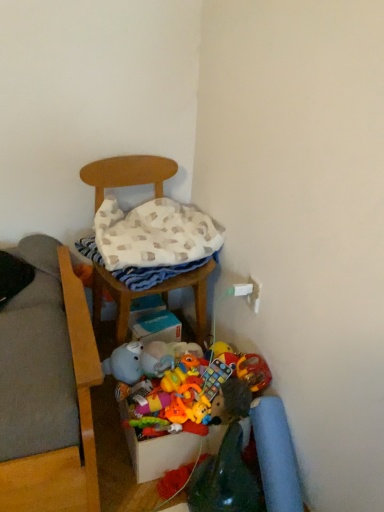
Question: Is wooden chair at center positioned far away from multicolored fabric storage box at lower center?

Choices:
 (A) no
 (B) yes

Answer: (A)

Question: Does wooden chair at center come behind multicolored fabric storage box at lower center?

Choices:
 (A) no
 (B) yes

Answer: (A)

Question: Does wooden chair at center have a larger size compared to multicolored fabric storage box at lower center?

Choices:
 (A) no
 (B) yes

Answer: (B)

Question: From the image's perspective, is wooden chair at center above multicolored fabric storage box at lower center?

Choices:
 (A) no
 (B) yes

Answer: (B)

Question: Is wooden chair at center thinner than multicolored fabric storage box at lower center?

Choices:
 (A) no
 (B) yes

Answer: (A)

Question: Is multicolored fabric storage box at lower center inside or outside of soft plush toy at center?

Choices:
 (A) outside
 (B) inside

Answer: (A)

Question: Considering the positions of multicolored fabric storage box at lower center and soft plush toy at center in the image, is multicolored fabric storage box at lower center wider or thinner than soft plush toy at center?

Choices:
 (A) wide
 (B) thin

Answer: (A)

Question: From a real-world perspective, is multicolored fabric storage box at lower center positioned above or below soft plush toy at center?

Choices:
 (A) above
 (B) below

Answer: (B)

Question: From their relative heights in the image, would you say multicolored fabric storage box at lower center is taller or shorter than soft plush toy at center?

Choices:
 (A) tall
 (B) short

Answer: (A)

Question: Considering the positions of point (165, 398) and point (180, 452), is point (165, 398) closer or farther from the camera than point (180, 452)?

Choices:
 (A) closer
 (B) farther

Answer: (A)

Question: From a real-world perspective, relative to multicolored fabric storage box at lower center, is soft plush toy at center vertically above or below?

Choices:
 (A) below
 (B) above

Answer: (B)

Question: Considering the positions of soft plush toy at center and multicolored fabric storage box at lower center in the image, is soft plush toy at center bigger or smaller than multicolored fabric storage box at lower center?

Choices:
 (A) big
 (B) small

Answer: (B)

Question: In the image, is soft plush toy at center positioned in front of or behind multicolored fabric storage box at lower center?

Choices:
 (A) front
 (B) behind

Answer: (B)

Question: Is soft plush toy at center spatially inside wooden chair at center, or outside of it?

Choices:
 (A) outside
 (B) inside

Answer: (A)

Question: Looking at their shapes, would you say soft plush toy at center is wider or thinner than wooden chair at center?

Choices:
 (A) wide
 (B) thin

Answer: (B)